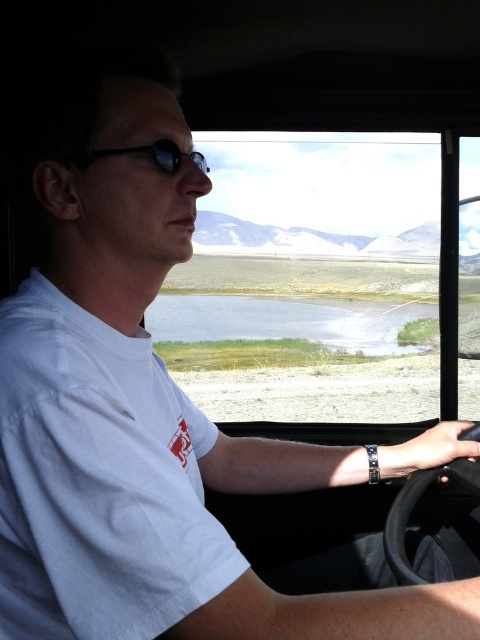
Who is positioned more to the right, white cotton t-shirt at left or sunglasses at center?

sunglasses at center

Is white cotton t-shirt at left thinner than sunglasses at center?

No.

Is point (197, 589) behind point (68, 163)?

No, (197, 589) is closer to viewer.

The image size is (480, 640). I want to click on white cotton t-shirt at left, so click(97, 481).